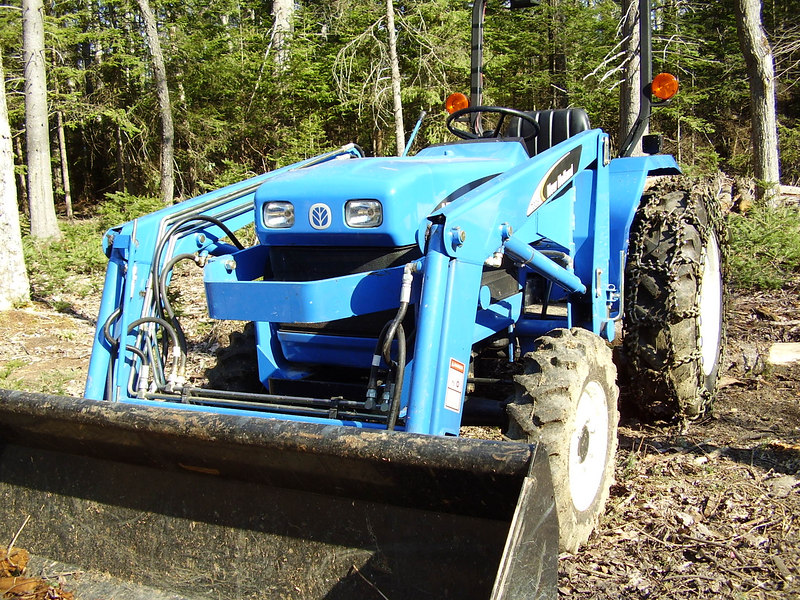
Find the location of a particular element. orange light is located at coordinates (670, 84).